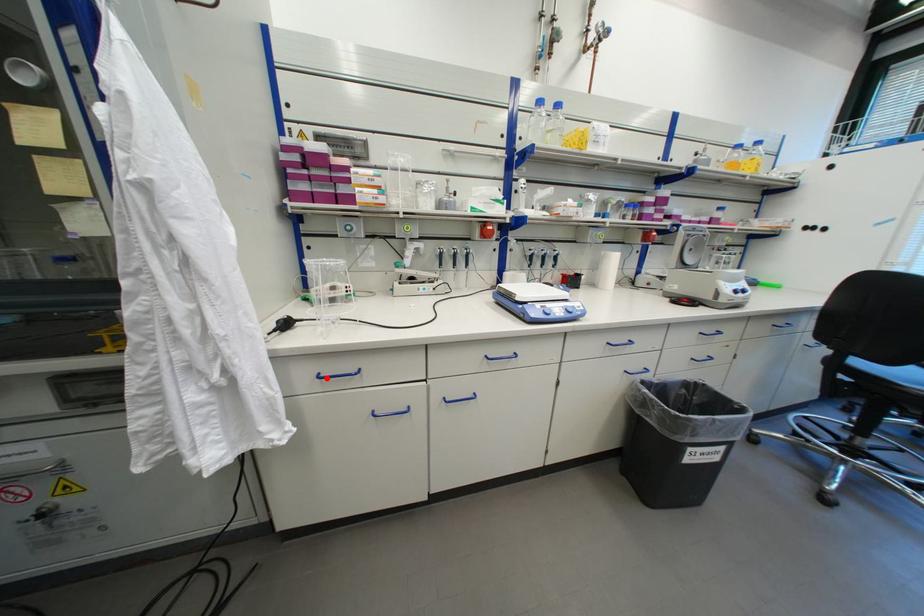
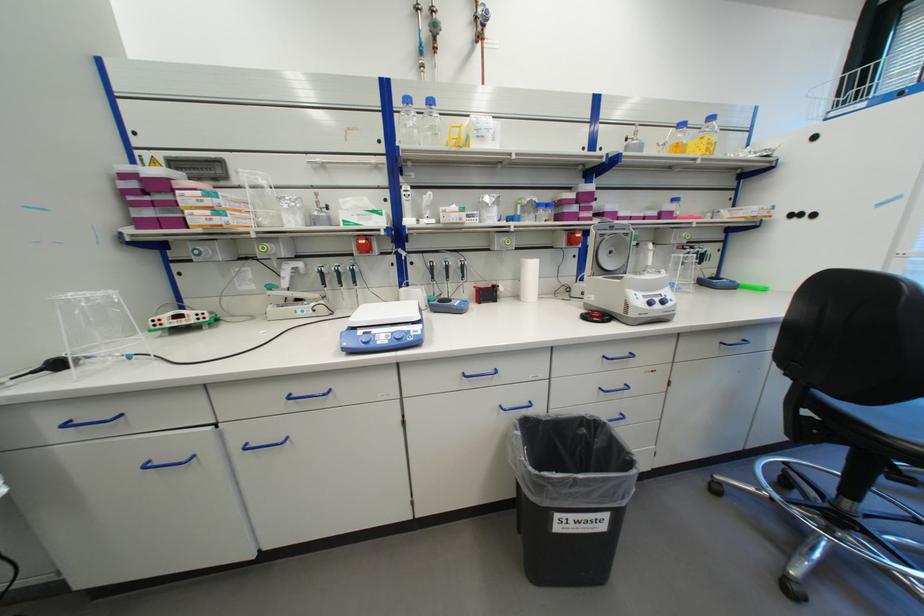
Locate, in the second image, the point that corresponds to the highlighted location in the first image.

(75, 426)